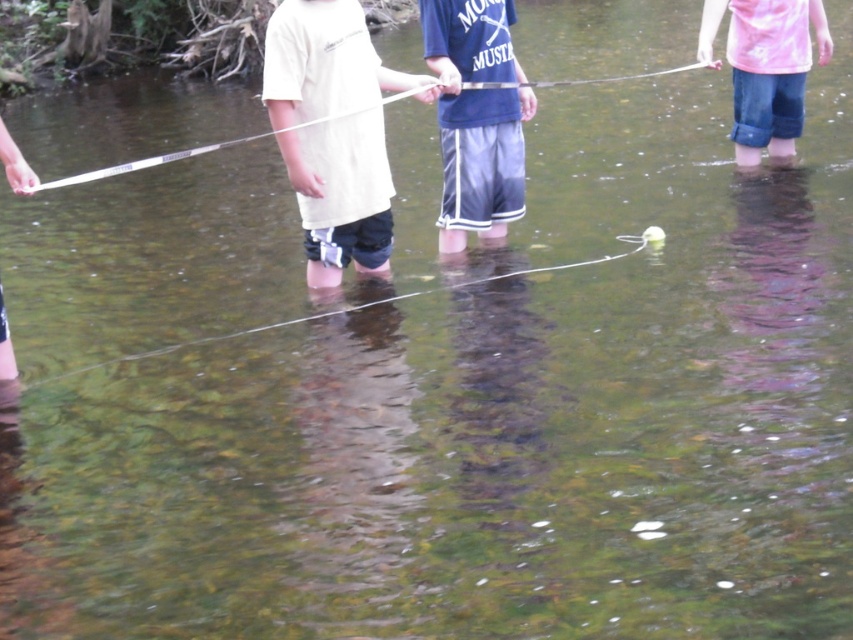
Question: Which point is farther to the camera?

Choices:
 (A) white matte shirt at center
 (B) pink cotton shirt at upper right

Answer: (B)

Question: Can you confirm if pink cotton shirt at upper right is positioned below white plastic string at center?

Choices:
 (A) no
 (B) yes

Answer: (A)

Question: Can you confirm if glossy blue shorts at center is positioned to the right of white plastic string at center?

Choices:
 (A) yes
 (B) no

Answer: (A)

Question: Is pink cotton shirt at upper right positioned before white plastic string at center?

Choices:
 (A) yes
 (B) no

Answer: (B)

Question: Which of the following is the farthest from the observer?

Choices:
 (A) white matte shirt at center
 (B) white plastic string at center
 (C) glossy blue shorts at center
 (D) pink cotton shirt at upper right

Answer: (D)

Question: Which of the following is the farthest from the observer?

Choices:
 (A) glossy blue shorts at center
 (B) pink cotton shirt at upper right
 (C) white plastic string at center
 (D) white matte shirt at center

Answer: (B)